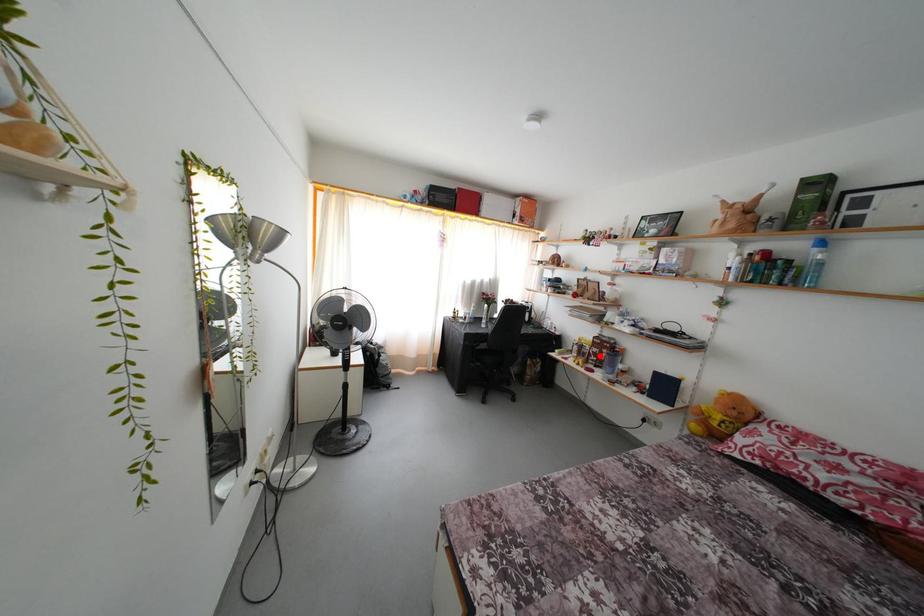
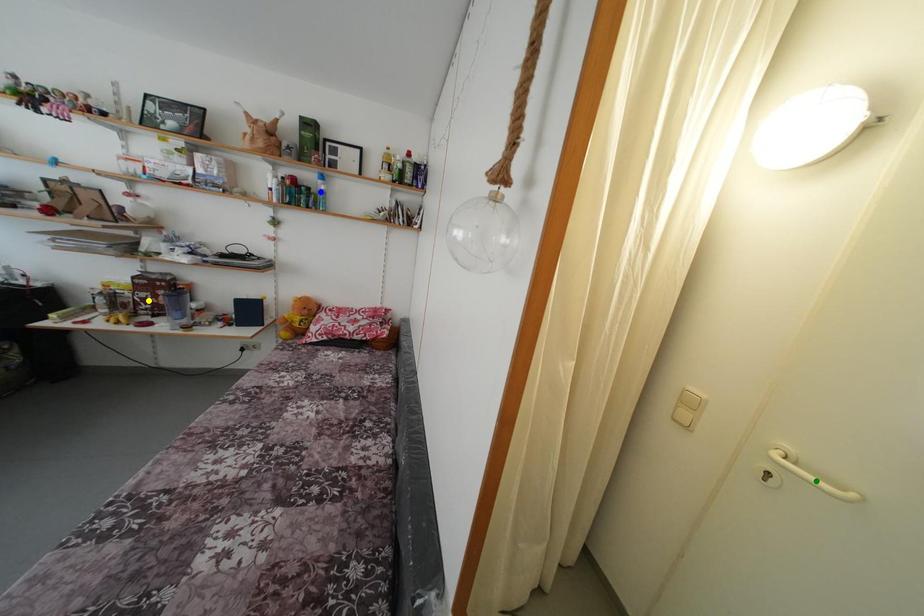
Question: I am providing you with two images of the same scene from different viewpoints. A red point is marked on the first image. You are given multiple points on the second image. Which spot in image 2 lines up with the point in image 1?

Choices:
 (A) blue point
 (B) green point
 (C) yellow point

Answer: (C)